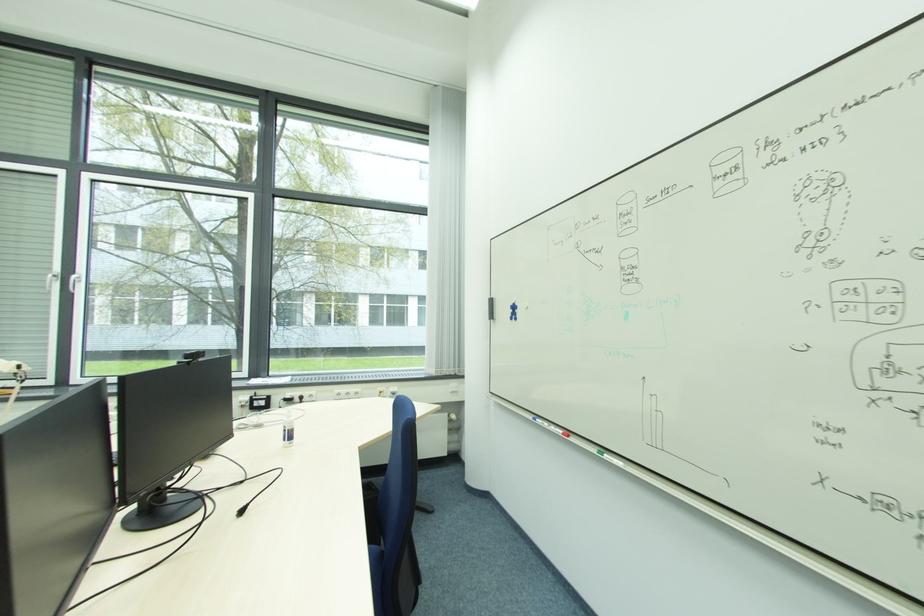
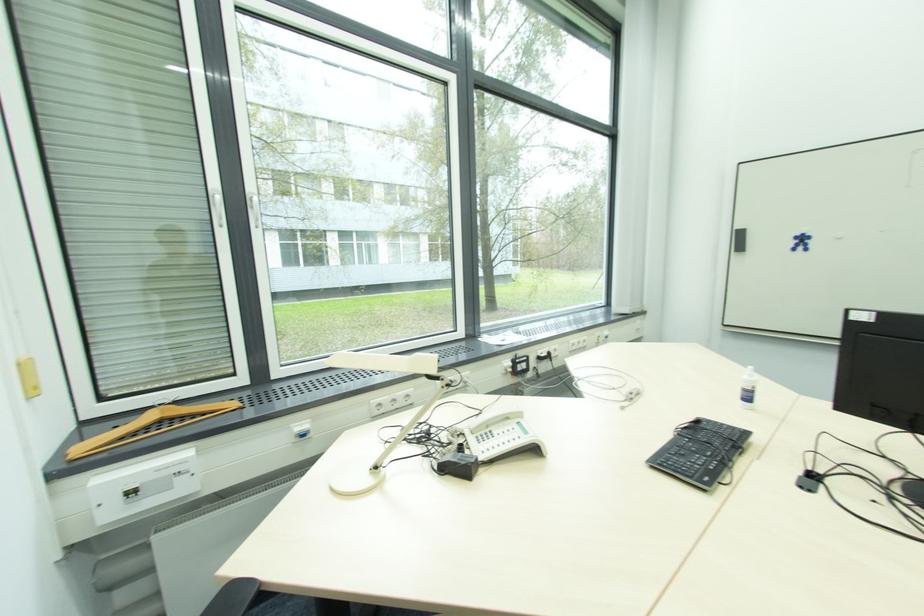
Question: Which direction would the cameraman need to move to produce the second image? Reply with the corresponding letter.

Choices:
 (A) Left
 (B) Right
 (C) Forward
 (D) Backward

Answer: (A)